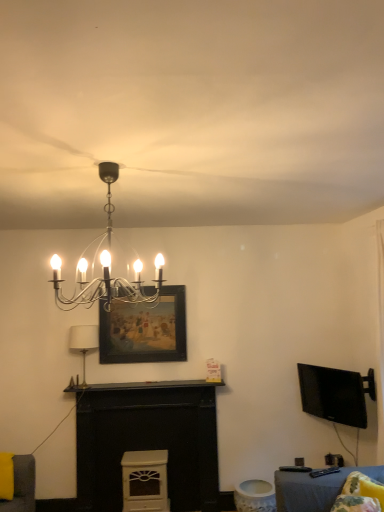
Question: Is there a large distance between white matte fireplace at center and black glossy tv at right?

Choices:
 (A) yes
 (B) no

Answer: (A)

Question: Does white matte fireplace at center have a larger size compared to black glossy tv at right?

Choices:
 (A) yes
 (B) no

Answer: (A)

Question: From a real-world perspective, does white matte fireplace at center stand above black glossy tv at right?

Choices:
 (A) yes
 (B) no

Answer: (B)

Question: Considering the relative sizes of white matte fireplace at center and black glossy tv at right in the image provided, is white matte fireplace at center thinner than black glossy tv at right?

Choices:
 (A) yes
 (B) no

Answer: (B)

Question: Is white matte fireplace at center to the left of black glossy tv at right from the viewer's perspective?

Choices:
 (A) yes
 (B) no

Answer: (A)

Question: From a real-world perspective, relative to white fabric lampshade at center-left, which is the first lamp in back-to-front order, is fluffy yellow pillow at lower right vertically above or below?

Choices:
 (A) above
 (B) below

Answer: (B)

Question: Considering their positions, is fluffy yellow pillow at lower right located in front of or behind white fabric lampshade at center-left, which is the first lamp in back-to-front order?

Choices:
 (A) behind
 (B) front

Answer: (B)

Question: Looking at their shapes, would you say fluffy yellow pillow at lower right is wider or thinner than white fabric lampshade at center-left, which is the first lamp in back-to-front order?

Choices:
 (A) wide
 (B) thin

Answer: (A)

Question: Considering the positions of fluffy yellow pillow at lower right and white fabric lampshade at center-left, the 1th lamp from the bottom, in the image, is fluffy yellow pillow at lower right bigger or smaller than white fabric lampshade at center-left, the 1th lamp from the bottom,?

Choices:
 (A) big
 (B) small

Answer: (B)

Question: Is polished chrome chandelier at upper center, the 2th lamp from the left, inside or outside of wooden framed painting at center?

Choices:
 (A) inside
 (B) outside

Answer: (B)

Question: Looking at the image, does polished chrome chandelier at upper center, which ranks as the second lamp in bottom-to-top order, seem bigger or smaller compared to wooden framed painting at center?

Choices:
 (A) small
 (B) big

Answer: (B)

Question: From a real-world perspective, relative to wooden framed painting at center, is polished chrome chandelier at upper center, the 2th lamp from the left, vertically above or below?

Choices:
 (A) above
 (B) below

Answer: (A)

Question: In terms of width, does polished chrome chandelier at upper center, placed as the first lamp when sorted from top to bottom, look wider or thinner when compared to wooden framed painting at center?

Choices:
 (A) thin
 (B) wide

Answer: (B)

Question: Based on their sizes in the image, would you say polished chrome chandelier at upper center, placed as the first lamp when sorted from top to bottom, is bigger or smaller than white matte fireplace at center?

Choices:
 (A) big
 (B) small

Answer: (B)

Question: Is polished chrome chandelier at upper center, acting as the first lamp starting from the right, spatially inside white matte fireplace at center, or outside of it?

Choices:
 (A) outside
 (B) inside

Answer: (A)